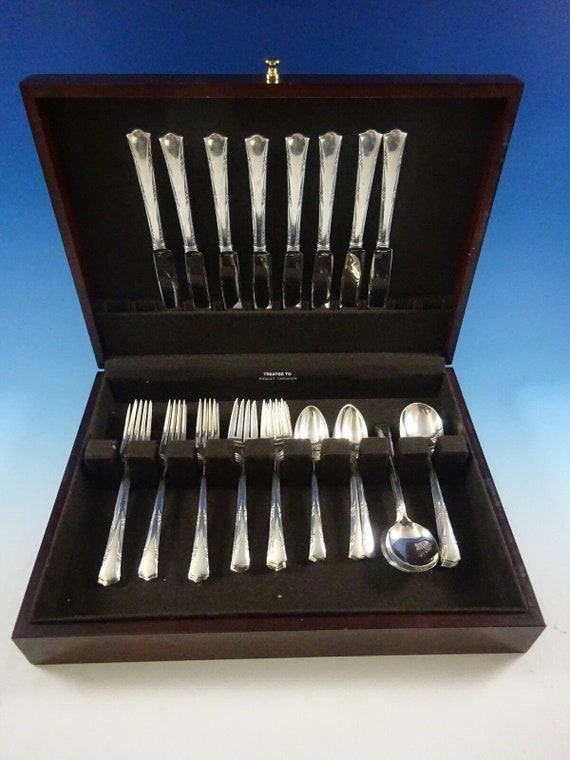
Where is `forks`? The height and width of the screenshot is (760, 570). forks is located at coordinates (119, 502), (156, 511), (201, 508), (239, 505), (274, 507).